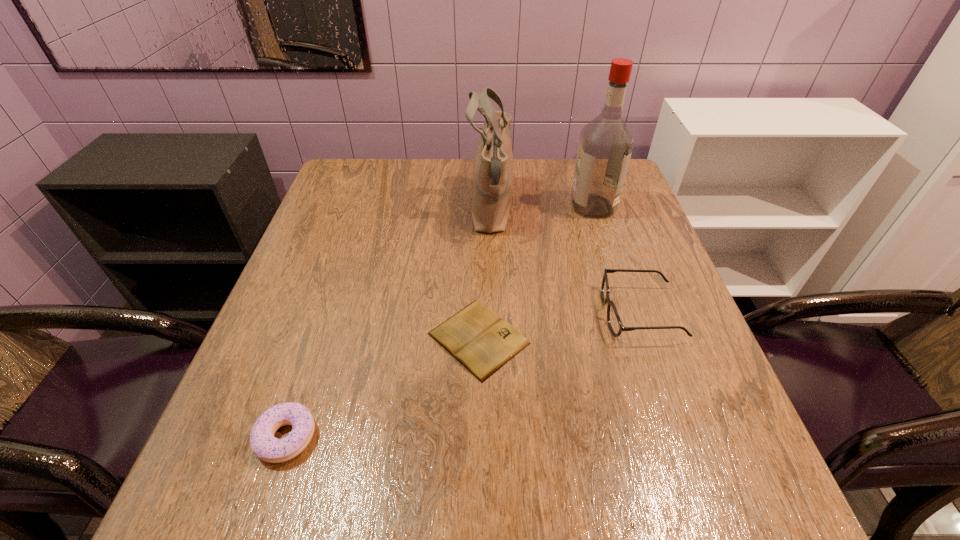
What are the coordinates of `free space that is in between the third tallest object and the second tallest object` in the screenshot? It's located at (565, 262).

Find the location of a particular element. This screenshot has height=540, width=960. free space that is in between the book and the nearest object is located at coordinates (382, 388).

I want to click on empty space between the spectacles and the shoulder bag, so click(x=565, y=262).

Where is `empty space that is in between the tallest object and the shortest object`? This screenshot has width=960, height=540. empty space that is in between the tallest object and the shortest object is located at coordinates (536, 273).

Locate an element on the screen. Image resolution: width=960 pixels, height=540 pixels. vacant area that lies between the second tallest object and the third shortest object is located at coordinates (565, 262).

What are the coordinates of `free space between the second tallest object and the spectacles` in the screenshot? It's located at (565, 262).

This screenshot has width=960, height=540. I want to click on vacant area that lies between the spectacles and the doughnut, so click(463, 375).

This screenshot has height=540, width=960. Identify the location of free spot between the fourth tallest object and the book. (382, 388).

Locate an element on the screen. The height and width of the screenshot is (540, 960). object that stands as the second closest to the spectacles is located at coordinates pos(493,170).

This screenshot has height=540, width=960. I want to click on object that can be found as the closest to the third shortest object, so click(476, 336).